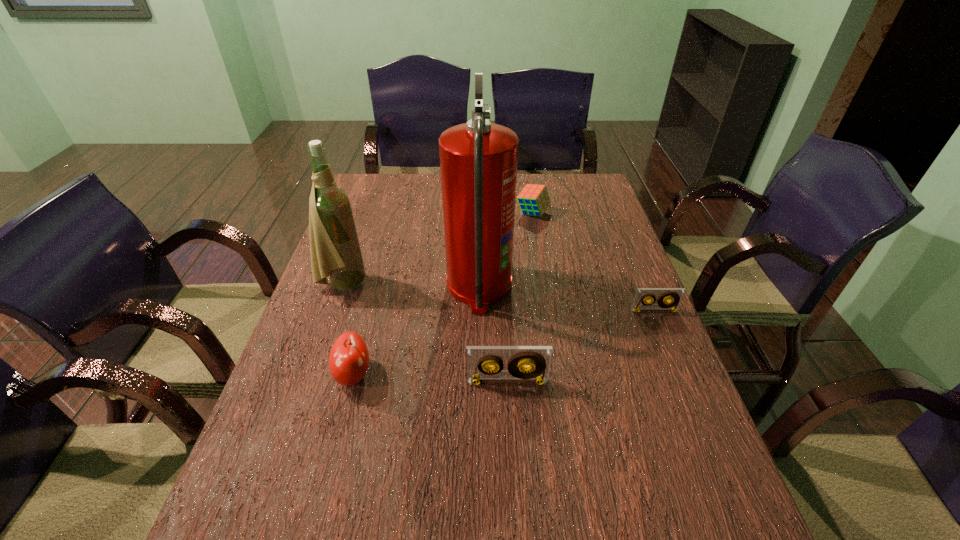
Image resolution: width=960 pixels, height=540 pixels. I want to click on free space located on the front of the farthest object, so tap(540, 255).

You are a GUI agent. You are given a task and a screenshot of the screen. Output one action in this format:
    pyautogui.click(x=<x>, y=<y>)
    Task: Click on the free space located 0.100m on the instruction side of the tallest object
    The image size is (960, 540).
    Given the screenshot: What is the action you would take?
    pyautogui.click(x=548, y=287)

Identify the location of free space located 0.160m on the back of the apple. (372, 306).

What are the coordinates of `free region located 0.370m on the front-facing side of the wine bottle` in the screenshot? It's located at (499, 284).

Where is `object that is at the far edge`? The height and width of the screenshot is (540, 960). object that is at the far edge is located at coordinates (534, 199).

I want to click on apple present at the left edge, so click(x=348, y=360).

At what (x,y) coordinates should I click in order to perform the action: click on wine bottle at the left edge. Please return your answer as a coordinate pair (x, y). Image resolution: width=960 pixels, height=540 pixels. Looking at the image, I should click on (335, 250).

Locate an element on the screen. Image resolution: width=960 pixels, height=540 pixels. object that is at the right edge is located at coordinates (x=675, y=295).

You are a GUI agent. You are given a task and a screenshot of the screen. Output one action in this format:
    pyautogui.click(x=<x>, y=<y>)
    Task: Click on the vacant space at the far edge of the desktop
    This screenshot has width=960, height=540.
    Given the screenshot: What is the action you would take?
    pyautogui.click(x=403, y=188)

In the image, there is a desktop. Find the location of `vacant space at the near edge`. vacant space at the near edge is located at coordinates (607, 454).